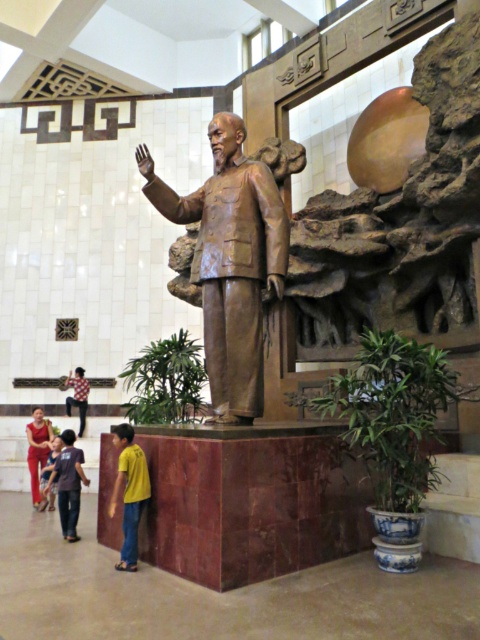
Question: Is bronze statue at center bigger than checkered shirt at lower left?

Choices:
 (A) no
 (B) yes

Answer: (B)

Question: Considering the real-world distances, which object is farthest from the checkered shirt at lower left?

Choices:
 (A) yellow cotton shirt at lower left
 (B) matte red pants at lower left
 (C) bronze statue at center
 (D) matte blue shirt at lower left

Answer: (C)

Question: Which point appears closest to the camera in this image?

Choices:
 (A) (131, 468)
 (B) (54, 452)
 (C) (72, 404)
 (D) (216, 280)

Answer: (A)

Question: Is checkered shirt at lower left above matte blue shirt at lower left?

Choices:
 (A) no
 (B) yes

Answer: (B)

Question: Which point is closer to the camera taking this photo?

Choices:
 (A) (225, 292)
 (B) (50, 472)
 (C) (131, 456)
 (D) (47, 445)

Answer: (C)

Question: Does matte red pants at lower left have a larger size compared to checkered shirt at lower left?

Choices:
 (A) no
 (B) yes

Answer: (B)